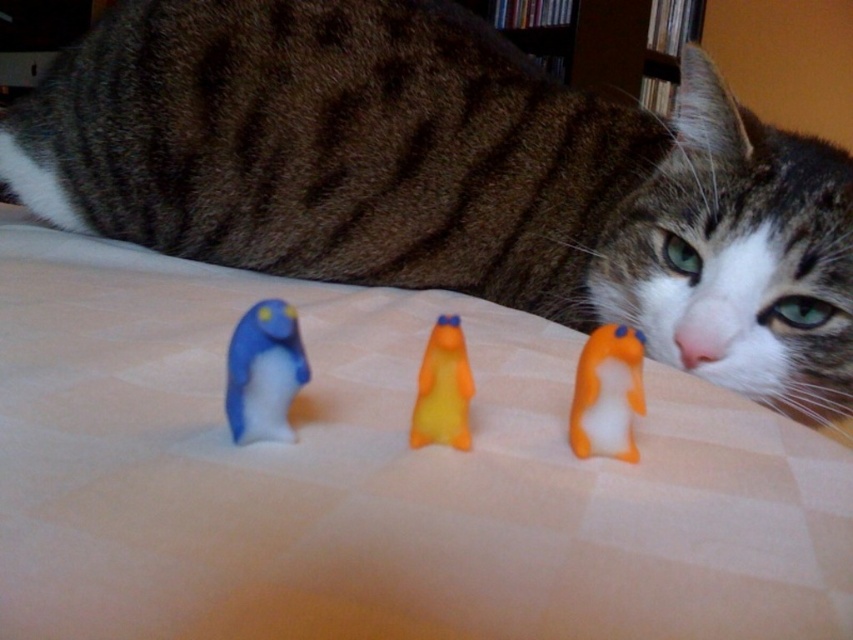
Question: Which of the following is the farthest from the observer?

Choices:
 (A) (776, 397)
 (B) (299, 356)

Answer: (A)

Question: Based on their relative distances, which object is farther from the orange matte plush toy at center?

Choices:
 (A) brown fur cat at upper center
 (B) blue rubber duck at center

Answer: (A)

Question: Does blue rubber duck at center have a larger size compared to orange rubber duck at center?

Choices:
 (A) yes
 (B) no

Answer: (B)

Question: Is brown fur cat at upper center below orange matte plush toy at center?

Choices:
 (A) yes
 (B) no

Answer: (B)

Question: Which is nearer to the orange matte plush toy at center?

Choices:
 (A) blue rubber duck at center
 (B) orange rubber duck at center

Answer: (B)

Question: Is brown fur cat at upper center closer to camera compared to orange rubber duck at center?

Choices:
 (A) no
 (B) yes

Answer: (A)